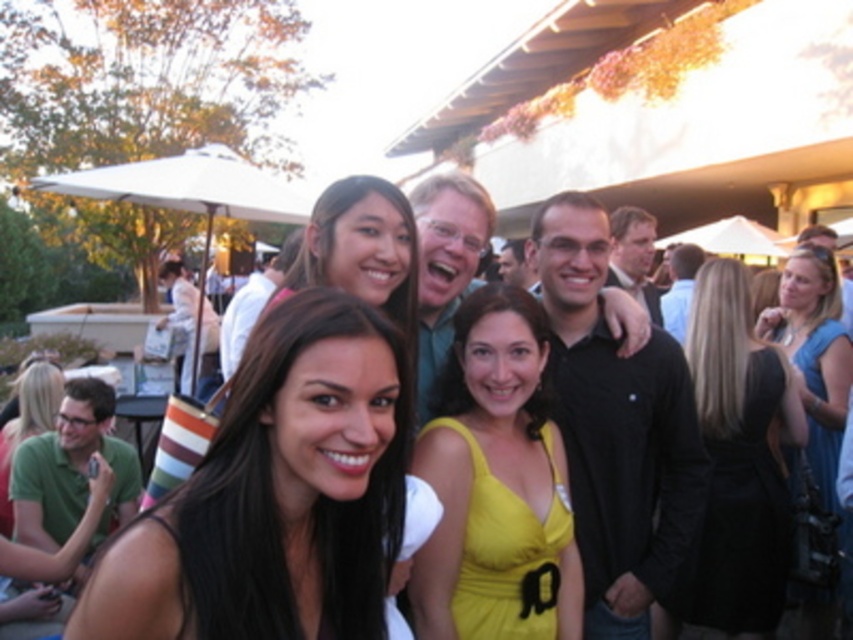
Question: Which point is farther from the camera taking this photo?

Choices:
 (A) (624, 228)
 (B) (476, 410)
 (C) (402, 529)

Answer: (A)

Question: Which of these objects is positioned closest to the black satin dress at center?

Choices:
 (A) green matte shirt at lower left
 (B) matte green dress at lower left
 (C) black matte shirt at center
 (D) blue satin dress at right

Answer: (D)

Question: Can you confirm if green matte shirt at lower left is bigger than matte green dress at lower left?

Choices:
 (A) yes
 (B) no

Answer: (B)

Question: Does yellow satin dress at center appear on the left side of matte black shirt at center?

Choices:
 (A) yes
 (B) no

Answer: (A)

Question: Estimate the real-world distances between objects in this image. Which object is farther from the black matte shirt at center?

Choices:
 (A) green matte shirt at lower left
 (B) smooth black dress at center
 (C) blue satin dress at right

Answer: (A)

Question: Does yellow satin dress at center appear over matte black shirt at center?

Choices:
 (A) yes
 (B) no

Answer: (B)